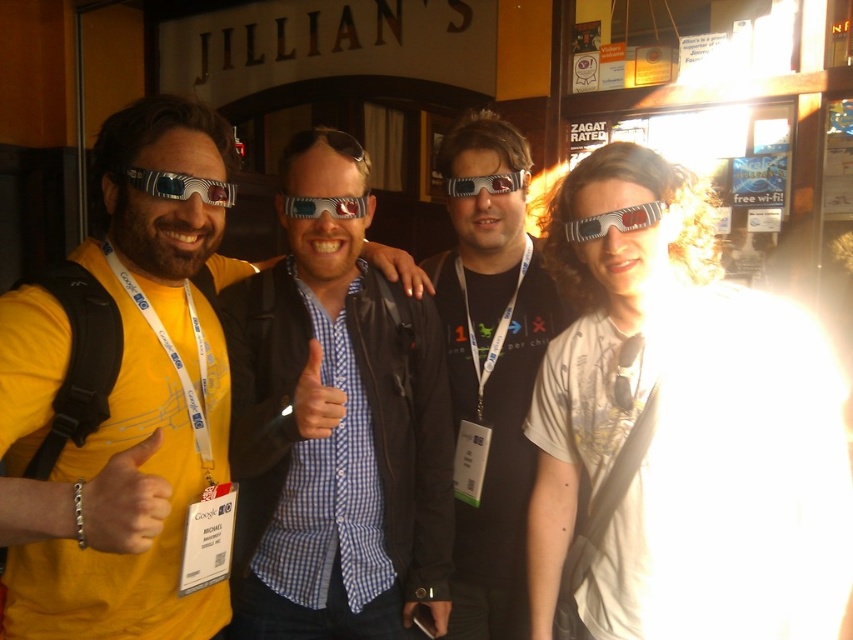
Question: Which point appears farthest from the camera in this image?

Choices:
 (A) (523, 176)
 (B) (358, 216)

Answer: (A)

Question: Can you confirm if yellow fabric at center is positioned to the right of clear plastic goggles at center?

Choices:
 (A) yes
 (B) no

Answer: (B)

Question: Estimate the real-world distances between objects in this image. Which object is farther from the matte black jacket at center?

Choices:
 (A) clear plastic goggles at center
 (B) yellow matte t-shirt at center

Answer: (B)

Question: Can you confirm if matte black jacket at center is positioned to the left of yellow fabric at center?

Choices:
 (A) yes
 (B) no

Answer: (B)

Question: Can you confirm if yellow matte t-shirt at center is positioned below matte plastic goggles at upper right?

Choices:
 (A) yes
 (B) no

Answer: (A)

Question: Which of the following is the closest to the observer?

Choices:
 (A) checkered fabric shirt at center
 (B) white matte sunglasses at center
 (C) matte black jacket at center
 (D) transparent plastic goggles at center

Answer: (B)